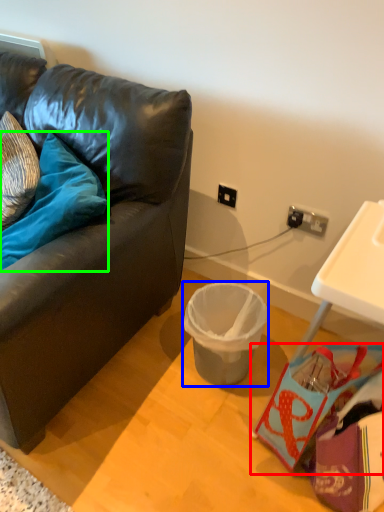
Question: Which is farther away from handbag (highlighted by a red box)? trash bin/can (highlighted by a blue box) or pillow (highlighted by a green box)?

Choices:
 (A) trash bin/can
 (B) pillow

Answer: (B)